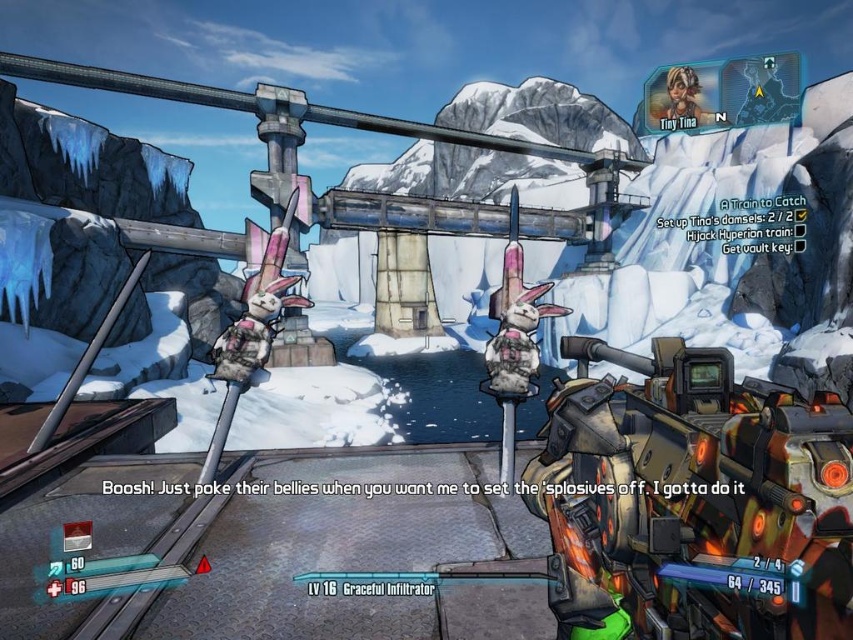
Is point (738, 522) more distant than point (775, 56)?

No, it is in front of (775, 56).

Is orange metallic robot at right closer to the viewer compared to metallic helmet at upper center?

Yes, it is.

Between point (724, 444) and point (675, 106), which one is positioned behind?

Point (675, 106)

Locate an element on the screen. The image size is (853, 640). orange metallic robot at right is located at coordinates (699, 493).